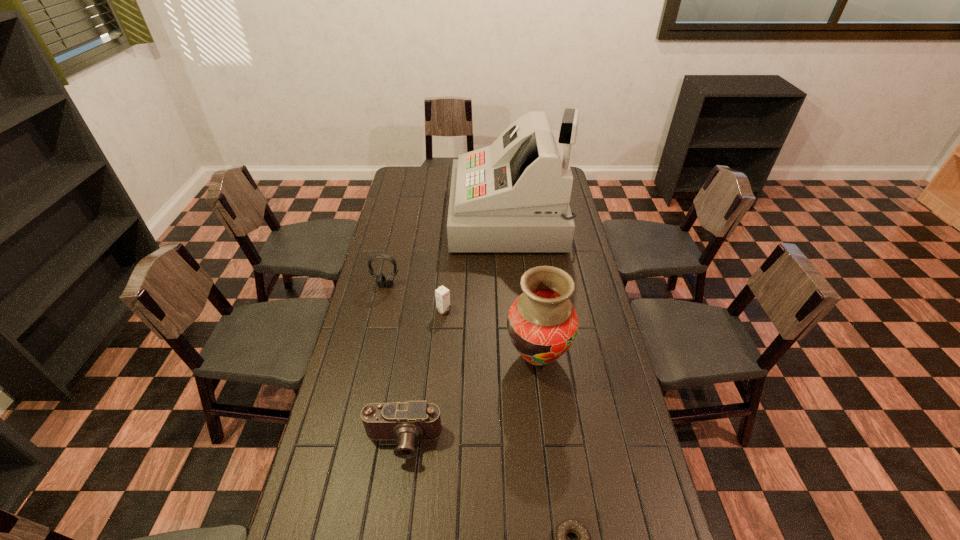
The width and height of the screenshot is (960, 540). Find the location of `the tallest object`. the tallest object is located at coordinates (513, 196).

I want to click on the farthest object, so click(513, 196).

You are a GUI agent. You are given a task and a screenshot of the screen. Output one action in this format:
    pyautogui.click(x=<x>, y=<y>)
    Task: Click on the vase
    The height and width of the screenshot is (540, 960).
    Given the screenshot: What is the action you would take?
    pyautogui.click(x=542, y=323)

Image resolution: width=960 pixels, height=540 pixels. Identify the location of the third nearest object. (542, 323).

I want to click on headset, so click(381, 281).

The width and height of the screenshot is (960, 540). I want to click on the second farthest object, so click(x=381, y=281).

Locate an element on the screen. This screenshot has height=540, width=960. the fifth farthest object is located at coordinates (406, 422).

I want to click on the third farthest object, so click(442, 294).

At what (x,y) coordinates should I click in order to perform the action: click on free spot located on the keypad side of the tallest object. Please return your answer as a coordinate pair (x, y). The image size is (960, 540). Looking at the image, I should click on (420, 218).

Where is `vacant space situated 0.050m on the keypad side of the tallest object`? The image size is (960, 540). vacant space situated 0.050m on the keypad side of the tallest object is located at coordinates (441, 218).